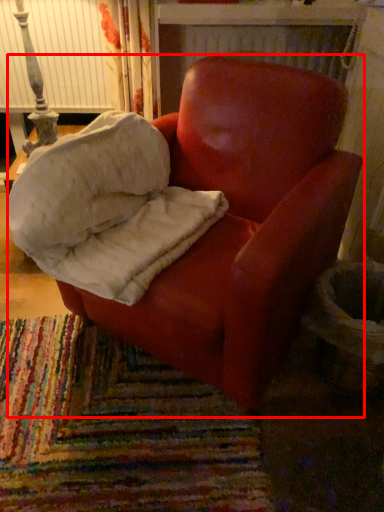
Question: Where is chair (annotated by the red box) located in relation to material in the image?

Choices:
 (A) left
 (B) right

Answer: (B)